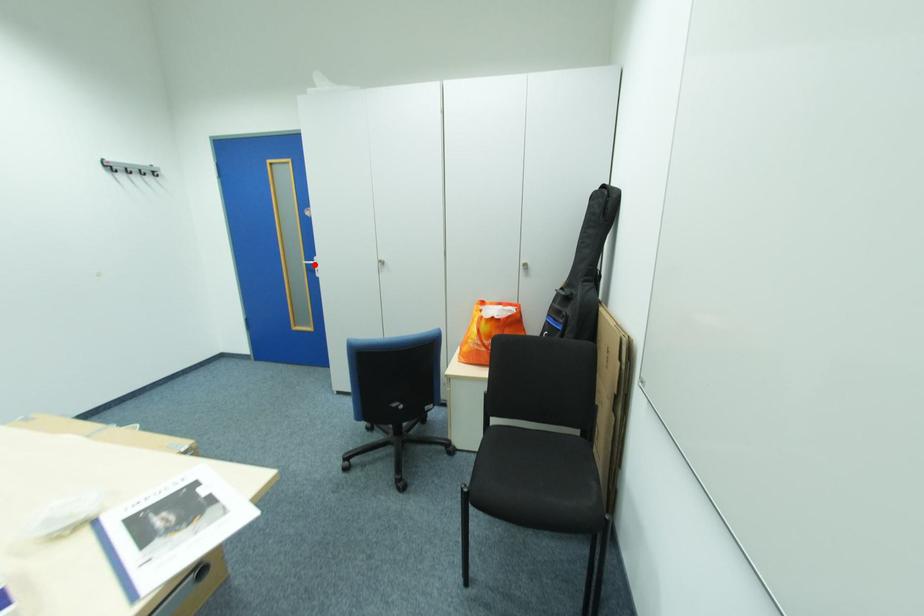
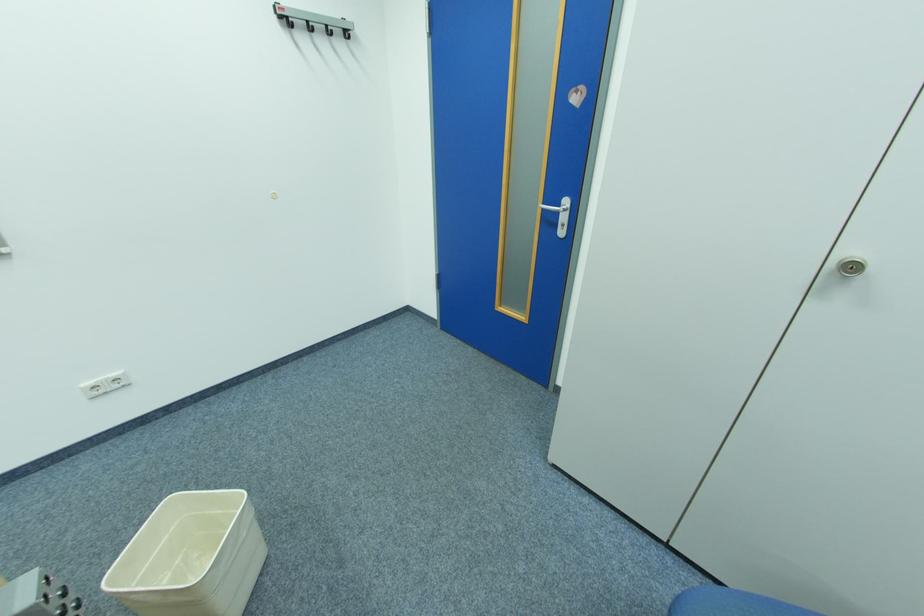
The point at the highlighted location is marked in the first image. Where is the corresponding point in the second image?

(552, 209)